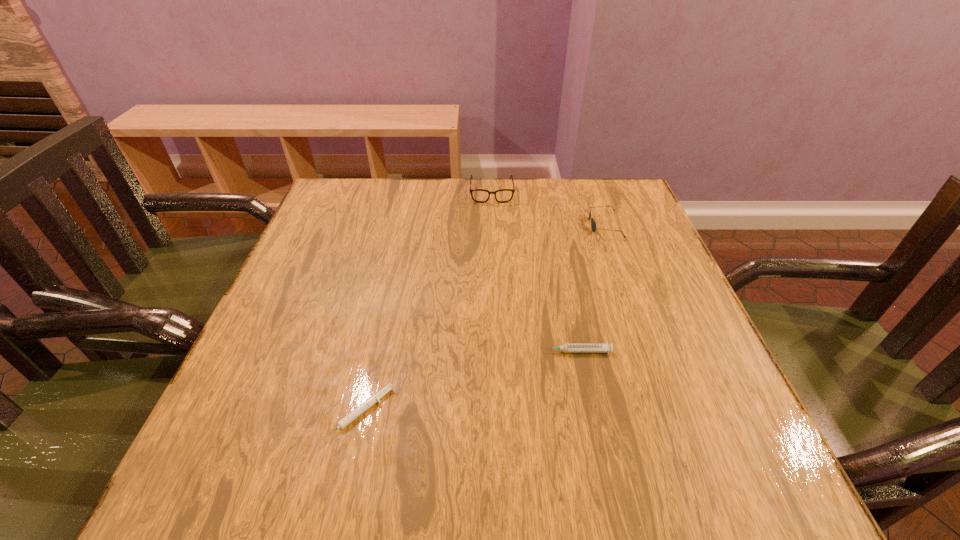
This screenshot has height=540, width=960. Find the location of `free space located on the lenses of the second farthest object`. free space located on the lenses of the second farthest object is located at coordinates (460, 225).

Locate an element on the screen. The height and width of the screenshot is (540, 960). vacant space positioned on the lenses of the second farthest object is located at coordinates (554, 225).

This screenshot has width=960, height=540. In order to click on blank area located 0.370m at the needle end of the second nearest object in this screenshot , I will do `click(342, 352)`.

Identify the location of vacant space situated at the needle end of the second nearest object. (379, 352).

Locate an element on the screen. Image resolution: width=960 pixels, height=540 pixels. vacant area situated at the needle end of the second nearest object is located at coordinates (492, 352).

Locate an element on the screen. free region located on the back of the shorter syringe is located at coordinates (390, 279).

This screenshot has height=540, width=960. Find the location of `spectacles present at the far edge`. spectacles present at the far edge is located at coordinates (478, 195).

You are a GUI agent. You are given a task and a screenshot of the screen. Output one action in this format:
    pyautogui.click(x=<x>, y=<y>)
    Task: Click on the sunglasses situated at the far edge
    This screenshot has width=960, height=540.
    Given the screenshot: What is the action you would take?
    pyautogui.click(x=593, y=225)

Find the location of a particular element. object present at the near edge is located at coordinates (374, 398).

You are a GUI agent. You are given a task and a screenshot of the screen. Output one action in this format:
    pyautogui.click(x=<x>, y=<y>)
    Task: Click on the object present at the right edge
    This screenshot has width=960, height=540.
    Given the screenshot: What is the action you would take?
    pyautogui.click(x=593, y=225)